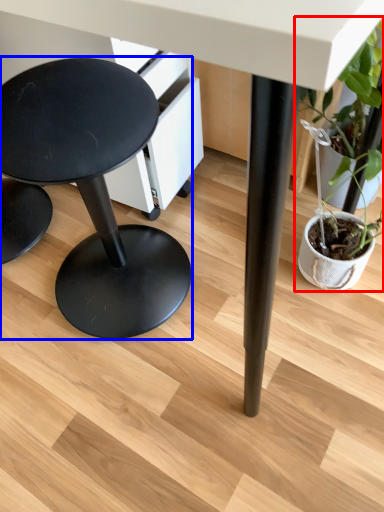
Question: Which object is closer to the camera taking this photo, houseplant (highlighted by a red box) or stool (highlighted by a blue box)?

Choices:
 (A) houseplant
 (B) stool

Answer: (B)